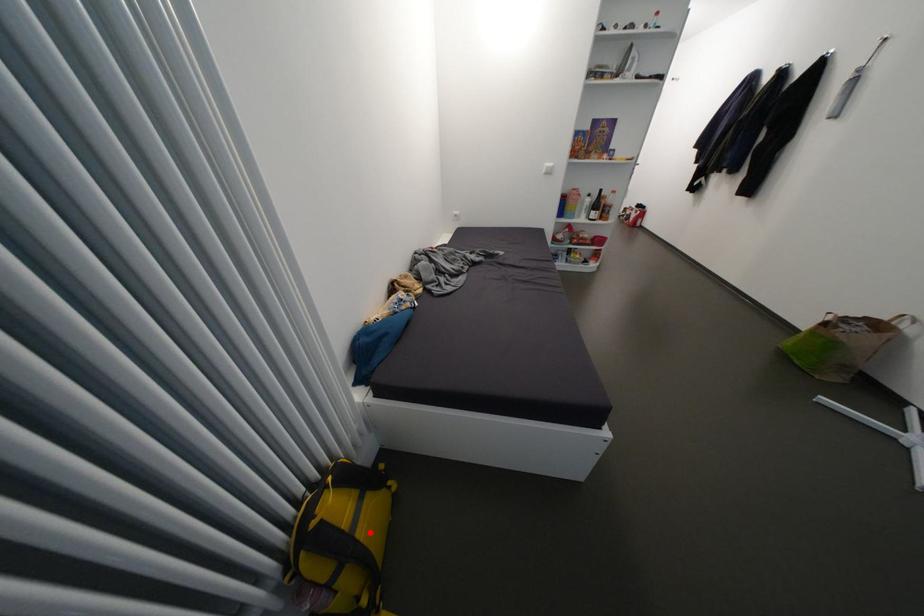
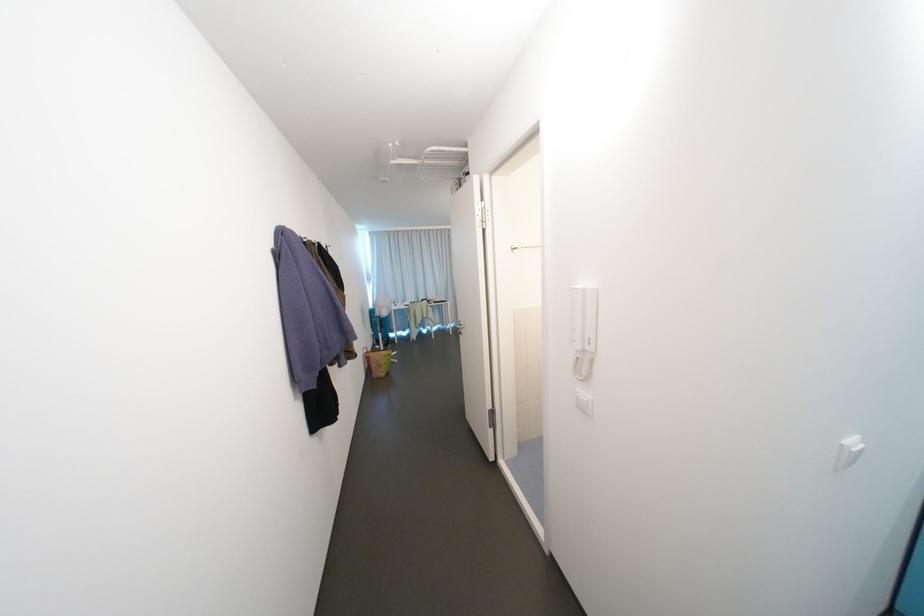
Question: I am providing you with two images of the same scene from different viewpoints. A red point is marked on the first image. Is the red point's position out of view in image 2?

Choices:
 (A) Yes
 (B) No

Answer: (A)